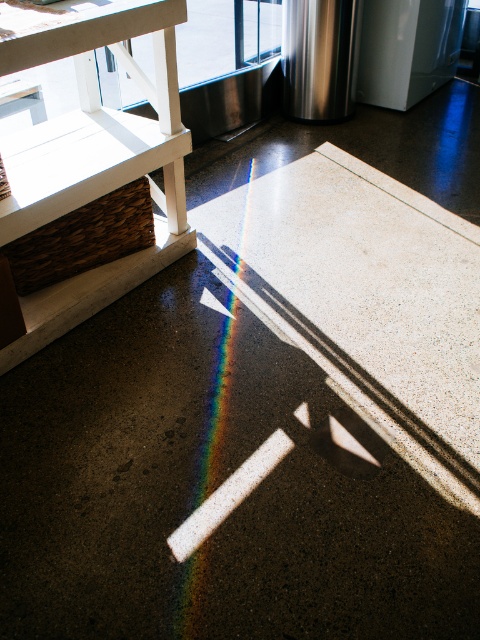
You are standing in the kitchen and want to reach a point that is 12.96 feet away from you. Is the point at coordinates point (99,61) within your reach?

The distance of point (99,61) from camera is 12.96 feet, so yes, the point at coordinates point (99,61) is exactly 12.96 feet away from you, which means it is within your reach if you can extend to that distance.

You are trying to move a large appliance into the kitchen. The appliance is 1 meter wide. You see the transparent glass door at upper center and the stainless steel refrigerator at upper right. Which one can the appliance pass through without needing to be disassembled?

The transparent glass door at upper center might be wider than stainless steel refrigerator at upper right, so the appliance can pass through the transparent glass door at upper center if it is indeed wider than 1 meter.

You are trying to determine if the rainbow at center can fit through the transparent glass door at upper center. Based on their sizes, what is your conclusion?

The transparent glass door at upper center is wider than the rainbow at center, so the rainbow at center can fit through the transparent glass door at upper center.